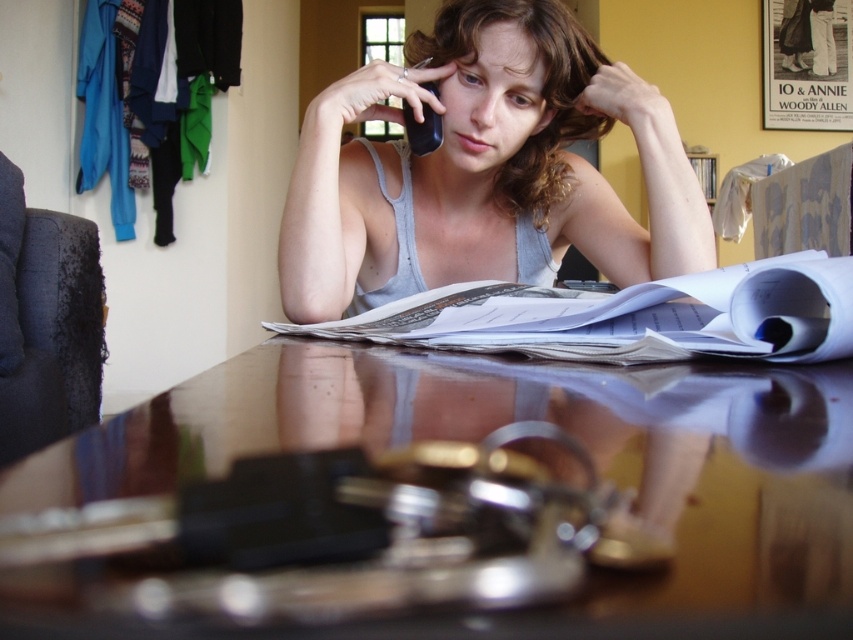
You are a fashion designer observing the image. You need to determine the position of the glossy wooden table at center relative to the gray cotton tank top at center. Which object is lower in height?

The glossy wooden table at center is shorter than the gray cotton tank top at center, so the glossy wooden table at center is lower in height.

You are a photographer trying to capture the woman in the image. If you want to focus on her gray cotton tank top at center without the glossy wooden table at center blocking the view, where should you position your camera relative to her?

The glossy wooden table at center is in front of the gray cotton tank top at center, so you should position the camera behind the woman to avoid the table blocking the view of the gray cotton tank top at center.